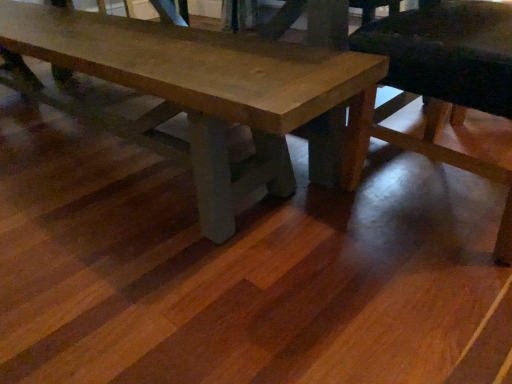
Question: Is wooden table at center aimed at wooden chair at lower right?

Choices:
 (A) no
 (B) yes

Answer: (B)

Question: Can you confirm if wooden table at center is positioned to the right of wooden chair at lower right?

Choices:
 (A) no
 (B) yes

Answer: (A)

Question: Would you say wooden table at center is outside wooden chair at lower right?

Choices:
 (A) yes
 (B) no

Answer: (A)

Question: Can you confirm if wooden table at center is wider than wooden chair at lower right?

Choices:
 (A) no
 (B) yes

Answer: (A)

Question: Can you confirm if wooden table at center is smaller than wooden chair at lower right?

Choices:
 (A) no
 (B) yes

Answer: (A)

Question: From the image's perspective, would you say wooden table at center is shown under wooden chair at lower right?

Choices:
 (A) yes
 (B) no

Answer: (B)

Question: Is wooden chair at lower right smaller than wooden table at center?

Choices:
 (A) yes
 (B) no

Answer: (A)

Question: Does wooden chair at lower right have a lesser width compared to wooden table at center?

Choices:
 (A) yes
 (B) no

Answer: (B)

Question: Is the depth of wooden chair at lower right less than that of wooden table at center?

Choices:
 (A) no
 (B) yes

Answer: (B)

Question: Considering the relative positions of wooden chair at lower right and wooden table at center in the image provided, is wooden chair at lower right behind wooden table at center?

Choices:
 (A) no
 (B) yes

Answer: (A)

Question: Can you confirm if wooden chair at lower right is taller than wooden table at center?

Choices:
 (A) yes
 (B) no

Answer: (A)

Question: Is wooden chair at lower right not near wooden table at center?

Choices:
 (A) yes
 (B) no

Answer: (B)

Question: From a real-world perspective, is wooden table at center physically located above or below wooden chair at lower right?

Choices:
 (A) below
 (B) above

Answer: (A)